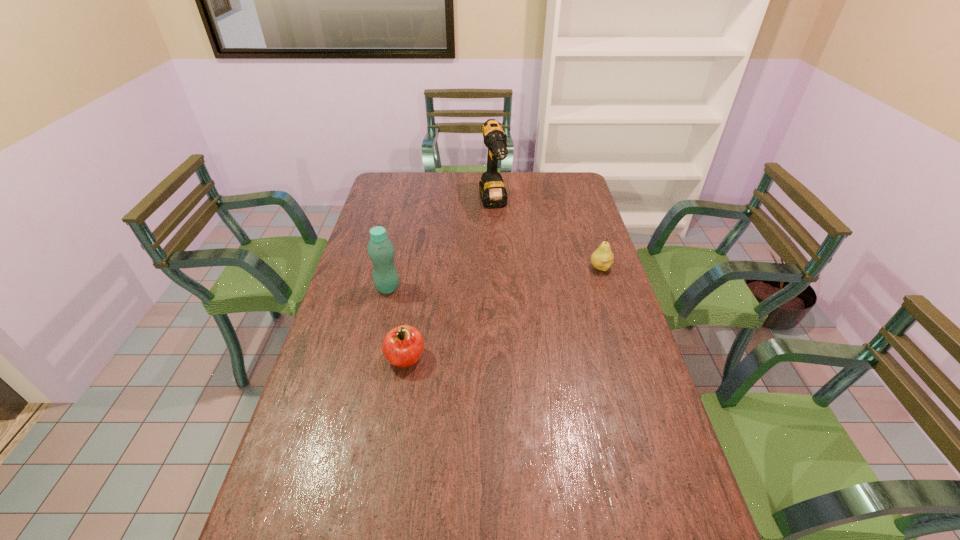
The image size is (960, 540). I want to click on vacant space on the desktop that is between the apple and the pear and is positioned at the front cap of the water bottle, so click(519, 305).

This screenshot has height=540, width=960. I want to click on vacant space on the desktop that is between the nearest object and the rightmost object and is positioned at the tip of the second object from right to left, so click(531, 300).